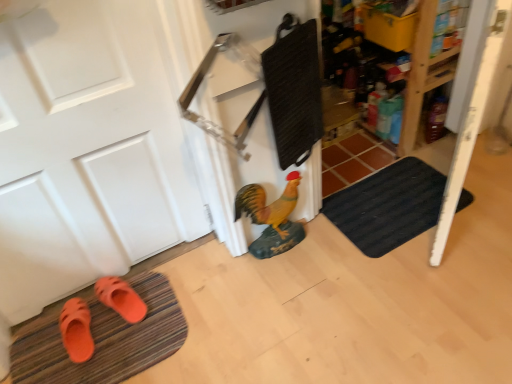
The width and height of the screenshot is (512, 384). What are the coordinates of `free space that is to the left of black textured bath mat at lower right, positioned as the first bath mat in top-to-bottom order` in the screenshot? It's located at (314, 256).